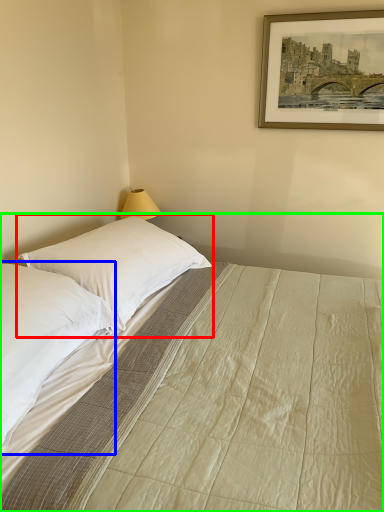
Question: Estimate the real-world distances between objects in this image. Which object is closer to pillow (highlighted by a red box), pillow (highlighted by a blue box) or bed (highlighted by a green box)?

Choices:
 (A) pillow
 (B) bed

Answer: (B)